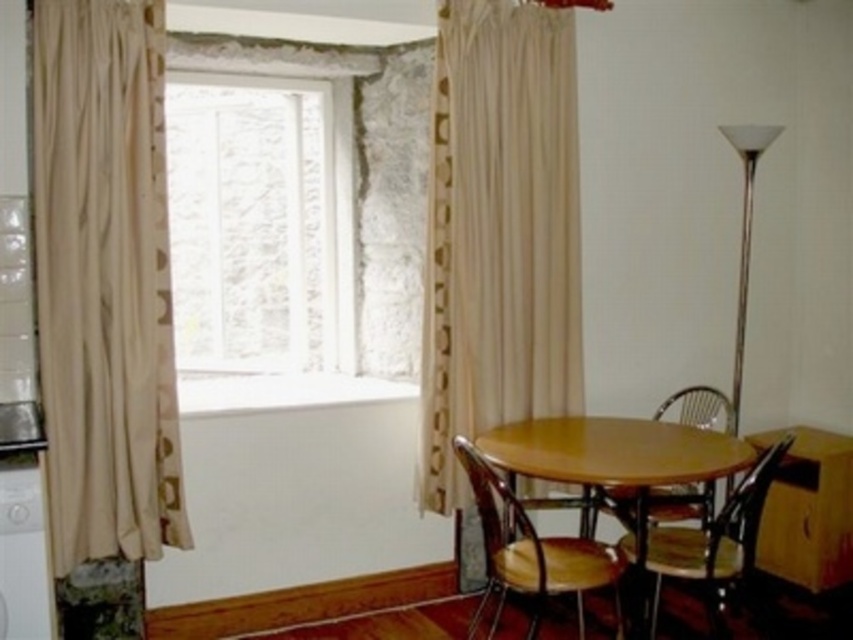
Question: Which object is the closest to the wooden at center?

Choices:
 (A) wooden table at center
 (B) wooden polished chair at lower right

Answer: (A)

Question: Which object is the farthest from the wooden table at center?

Choices:
 (A) wooden at center
 (B) beige fabric curtain at left
 (C) wooden polished chair at lower right

Answer: (B)

Question: Can you confirm if beige fabric curtain at left is smaller than wooden table at center?

Choices:
 (A) no
 (B) yes

Answer: (B)

Question: Observing the image, what is the correct spatial positioning of wooden polished chair at lower right in reference to white glossy washing machine at left?

Choices:
 (A) right
 (B) left

Answer: (A)

Question: Can you confirm if beige fabric curtain at left is bigger than wooden polished chair at lower right?

Choices:
 (A) yes
 (B) no

Answer: (B)

Question: Based on their relative distances, which object is nearer to the beige fabric curtain at center?

Choices:
 (A) beige fabric curtain at left
 (B) wooden table at center
 (C) metallic silver chair at center

Answer: (B)